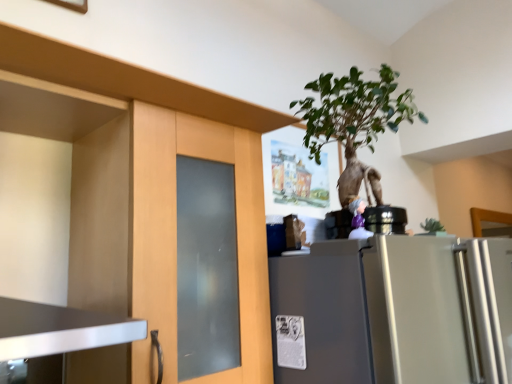
Question: Should I look upward or downward to see matte wood cabinet at left?

Choices:
 (A) down
 (B) up

Answer: (A)

Question: Does matte wood cabinet at left have a greater width compared to green leafy plant at upper center?

Choices:
 (A) yes
 (B) no

Answer: (A)

Question: Would you consider matte wood cabinet at left to be distant from green leafy plant at upper center?

Choices:
 (A) no
 (B) yes

Answer: (A)

Question: Considering the relative sizes of matte wood cabinet at left and green leafy plant at upper center in the image provided, is matte wood cabinet at left smaller than green leafy plant at upper center?

Choices:
 (A) no
 (B) yes

Answer: (A)

Question: Does matte wood cabinet at left have a lesser width compared to green leafy plant at upper center?

Choices:
 (A) yes
 (B) no

Answer: (B)

Question: Is matte wood cabinet at left at the left side of green leafy plant at upper center?

Choices:
 (A) no
 (B) yes

Answer: (B)

Question: Can you confirm if matte wood cabinet at left is positioned to the right of green leafy plant at upper center?

Choices:
 (A) no
 (B) yes

Answer: (A)

Question: Is matte wood cabinet at left surrounded by satin silver refrigerator at right?

Choices:
 (A) yes
 (B) no

Answer: (B)

Question: Is satin silver refrigerator at right touching matte wood cabinet at left?

Choices:
 (A) yes
 (B) no

Answer: (B)

Question: Is satin silver refrigerator at right bigger than matte wood cabinet at left?

Choices:
 (A) no
 (B) yes

Answer: (B)

Question: Is satin silver refrigerator at right to the left of matte wood cabinet at left from the viewer's perspective?

Choices:
 (A) yes
 (B) no

Answer: (B)

Question: Is satin silver refrigerator at right shorter than matte wood cabinet at left?

Choices:
 (A) yes
 (B) no

Answer: (B)

Question: Is satin silver refrigerator at right thinner than matte wood cabinet at left?

Choices:
 (A) no
 (B) yes

Answer: (A)

Question: Can you confirm if green leafy plant at upper center is wider than matte wood cabinet at left?

Choices:
 (A) no
 (B) yes

Answer: (A)